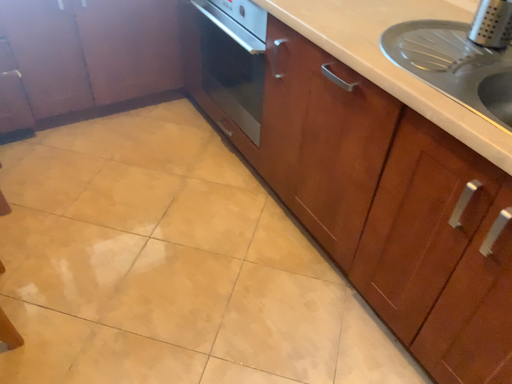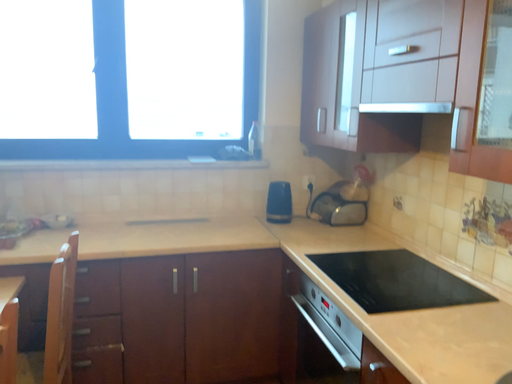
Question: Which way did the camera rotate in the video?

Choices:
 (A) rotated right
 (B) rotated left

Answer: (B)